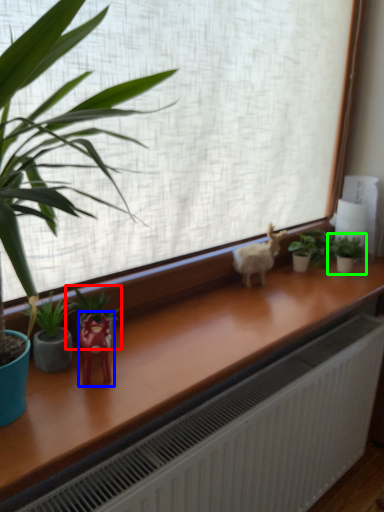
Question: Based on their relative distances, which object is nearer to houseplant (highlighted by a red box)? Choose from miniature (highlighted by a blue box) and houseplant (highlighted by a green box).

Choices:
 (A) miniature
 (B) houseplant

Answer: (A)